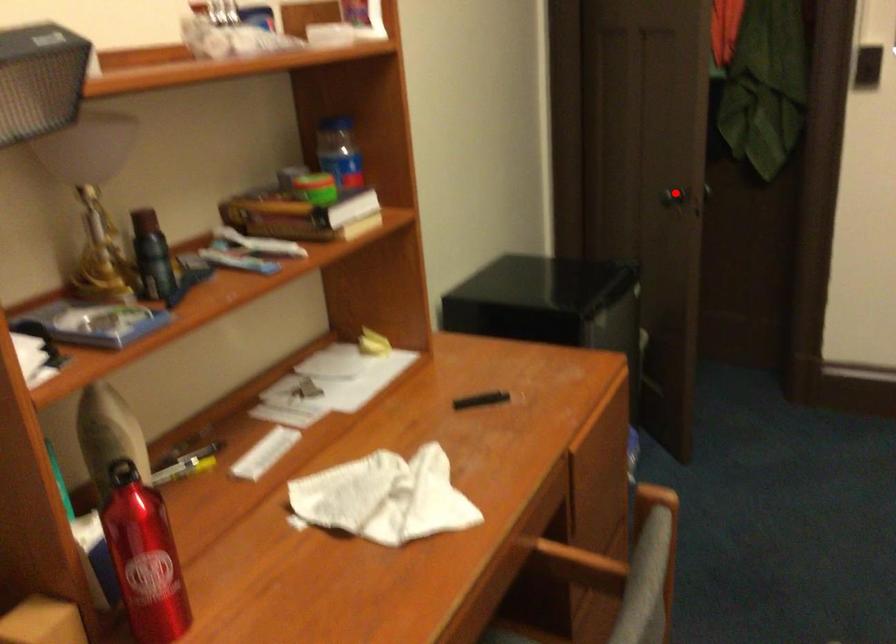
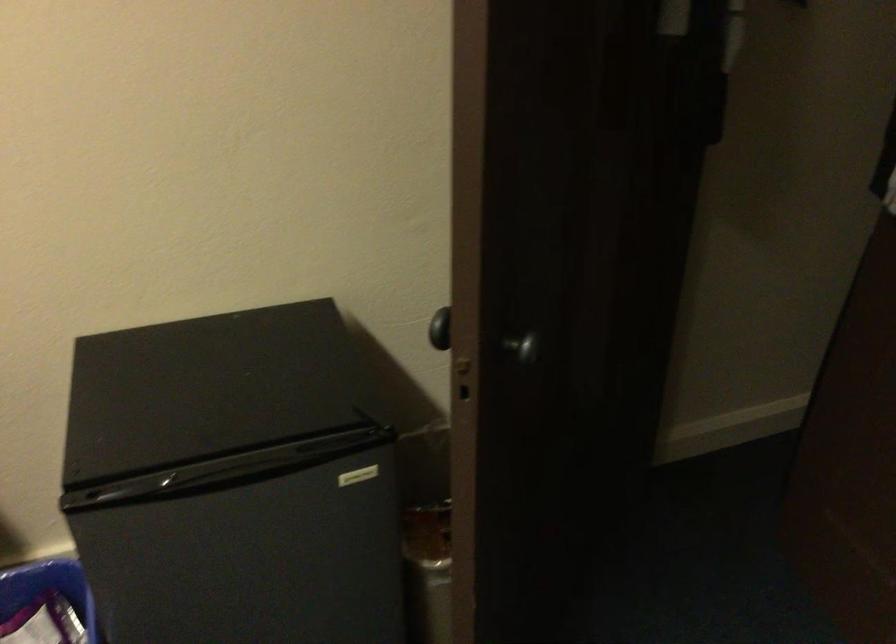
Find the pixel in the second image that matches the highlighted location in the first image.

(440, 328)